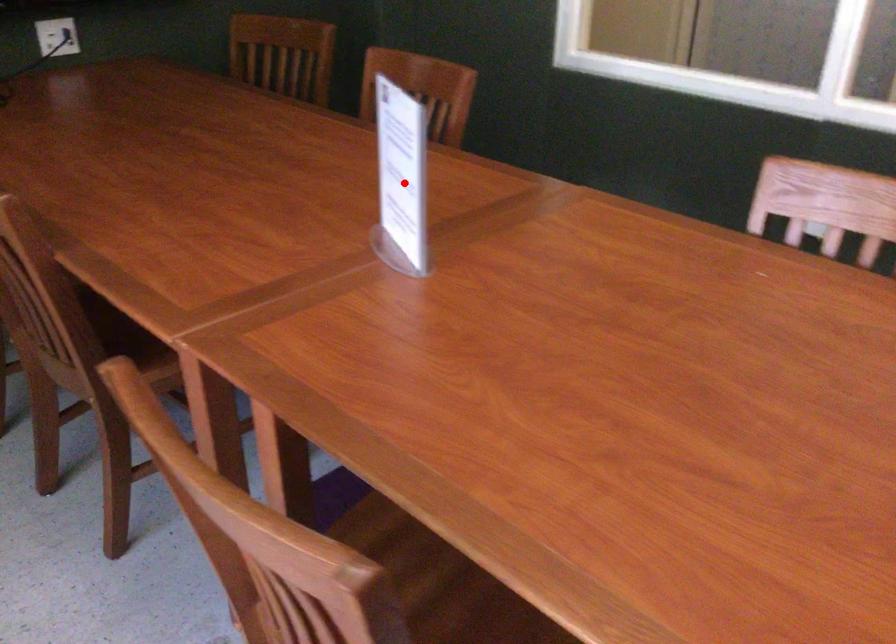
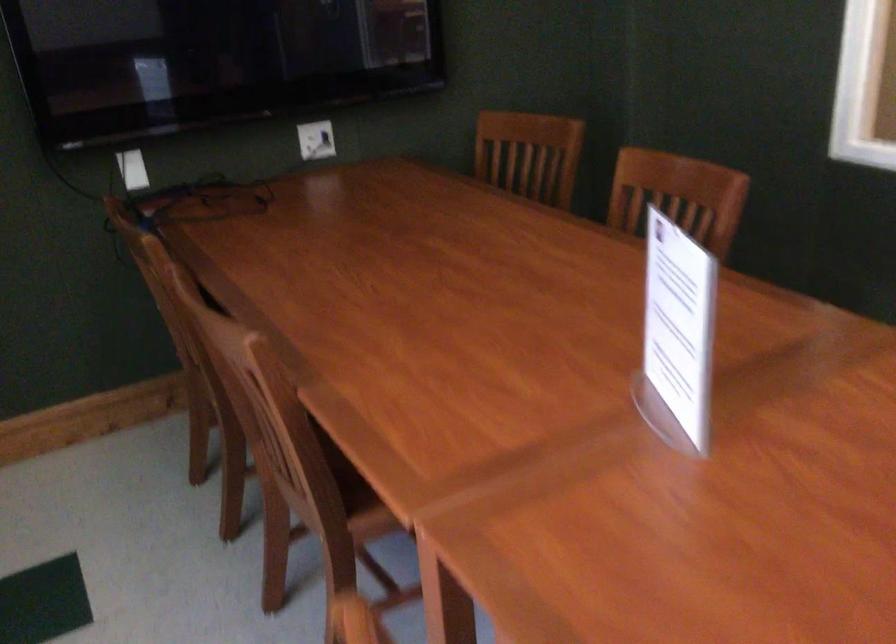
Find the pixel in the second image that matches the highlighted location in the first image.

(677, 335)